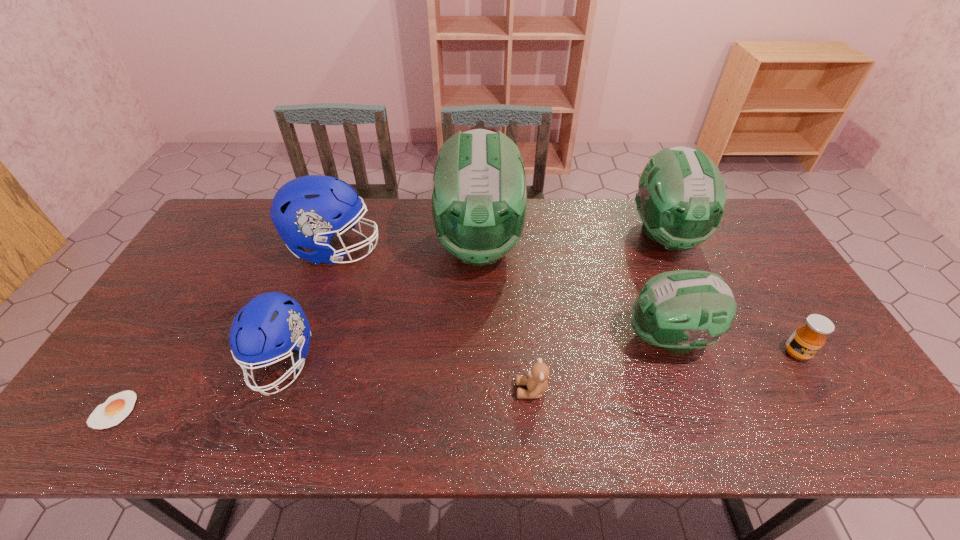
Where is `vacant space located 0.330m on the face of the second shortest object`? This screenshot has height=540, width=960. vacant space located 0.330m on the face of the second shortest object is located at coordinates (378, 390).

The width and height of the screenshot is (960, 540). What are the coordinates of `blank space located on the face of the second shortest object` in the screenshot? It's located at (432, 390).

The height and width of the screenshot is (540, 960). I want to click on vacant space located 0.220m on the face of the second shortest object, so click(x=424, y=390).

Locate an element on the screen. free space located 0.050m on the right of the egg yolk is located at coordinates (156, 410).

Find the location of a particular element. The image size is (960, 540). object that is positioned at the near edge is located at coordinates (116, 408).

The image size is (960, 540). Identify the location of object located in the left edge section of the desktop. (116, 408).

Locate an element on the screen. This screenshot has width=960, height=540. object that is at the right edge is located at coordinates (808, 338).

Find the location of `object positioned at the near left corner`. object positioned at the near left corner is located at coordinates (116, 408).

Locate an element on the screen. Image resolution: width=960 pixels, height=540 pixels. free space at the far edge is located at coordinates (541, 200).

Locate an element on the screen. This screenshot has width=960, height=540. vacant space at the near edge is located at coordinates (425, 415).